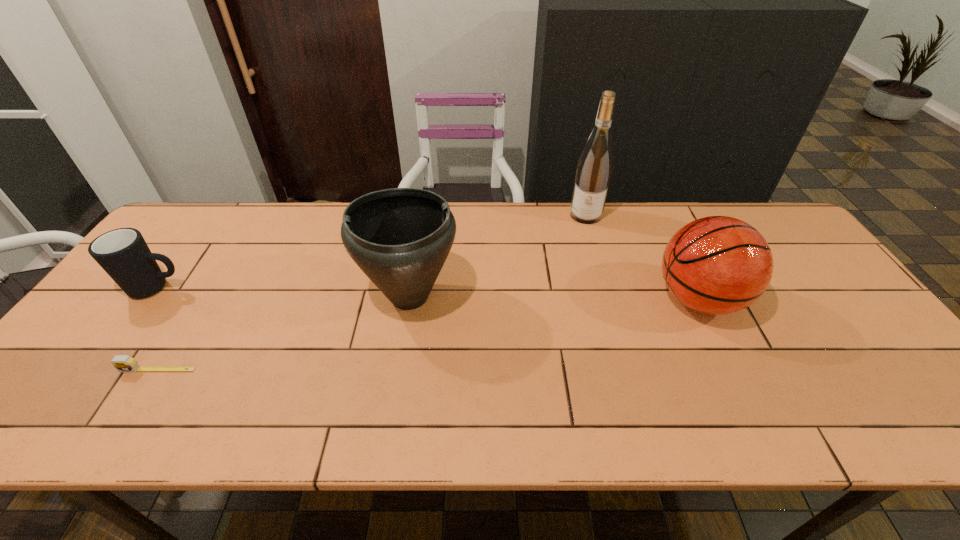
Find the location of a particular element. This screenshot has height=540, width=960. the farthest object is located at coordinates (594, 170).

The width and height of the screenshot is (960, 540). What are the coordinates of `wine bottle` in the screenshot? It's located at (594, 170).

Find the location of `urn`. urn is located at coordinates (400, 238).

At what (x,y) coordinates should I click in order to perform the action: click on the third shortest object. Please return your answer as a coordinate pair (x, y). Image resolution: width=960 pixels, height=540 pixels. Looking at the image, I should click on (717, 265).

Identify the location of basketball. click(x=717, y=265).

What are the coordinates of `mug` in the screenshot? It's located at (123, 253).

The image size is (960, 540). What are the coordinates of `the nearest object` in the screenshot? It's located at (123, 363).

Where is `tape measure`? The image size is (960, 540). tape measure is located at coordinates (123, 363).

Locate an element on the screen. free space located on the front of the fourth object from left to right is located at coordinates (595, 248).

Find the location of a particular element. The width and height of the screenshot is (960, 540). vacant area situated 0.110m on the front of the urn is located at coordinates (398, 370).